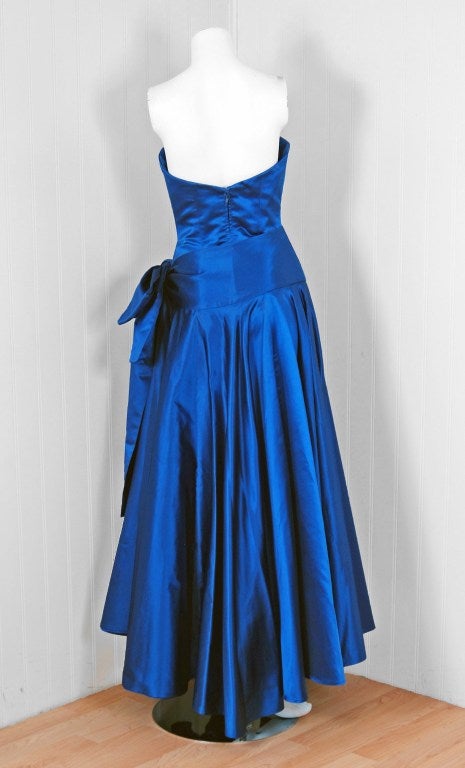
Identify the location of floor. (388, 716).